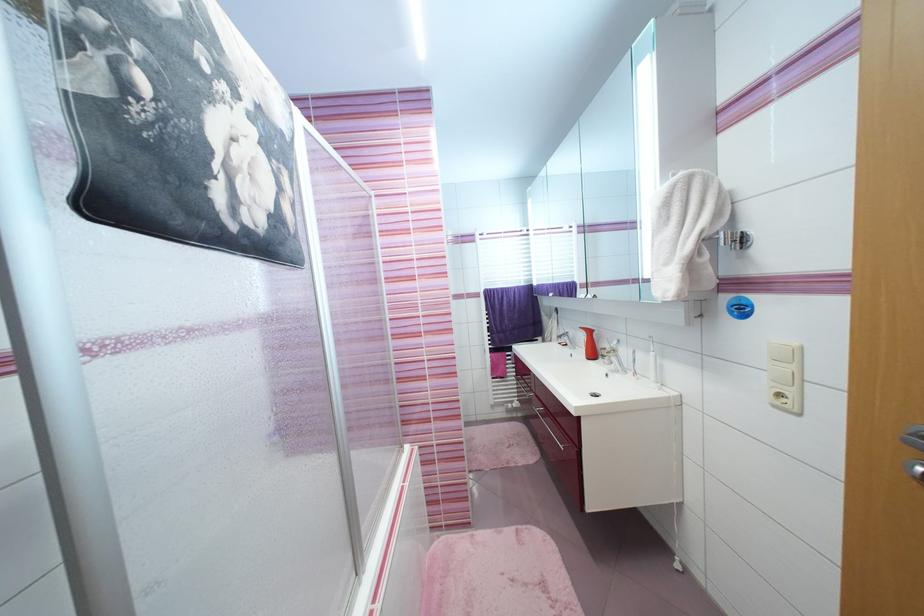
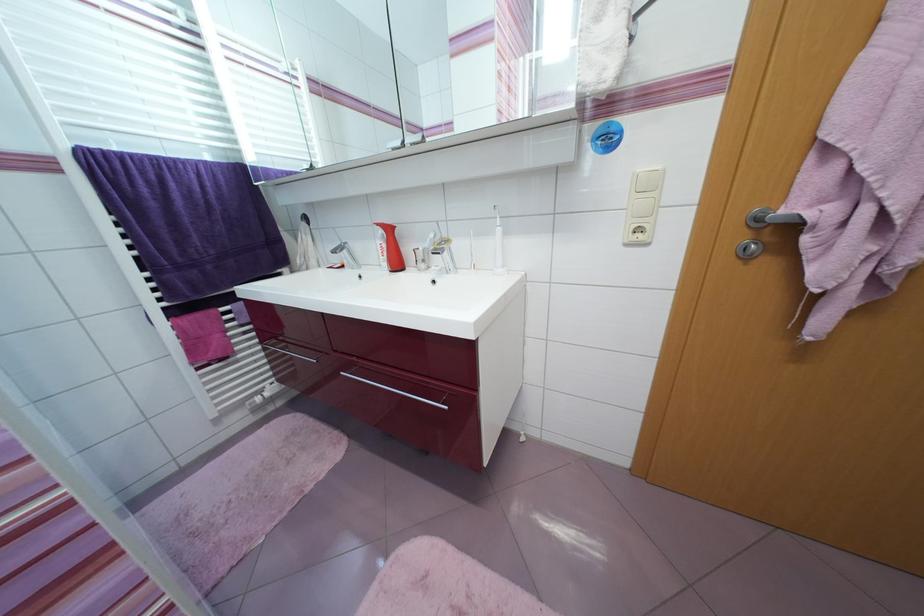
The point at (594,333) is marked in the first image. Where is the corresponding point in the second image?

(394, 231)